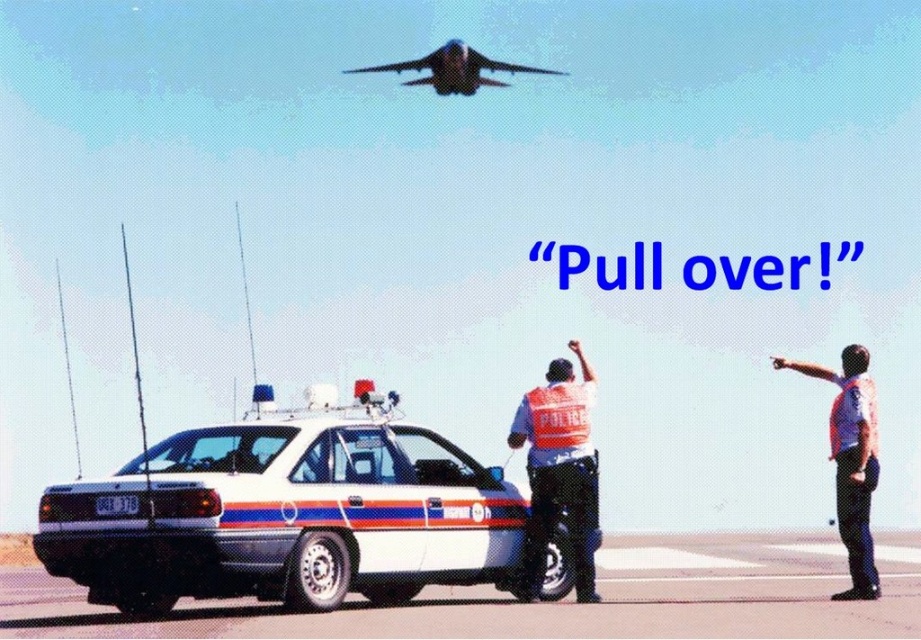
Consider the image. You are a photographer trying to capture a wide shot of the white glossy police car at center and the light blue uniform at center. Given that your camera can only focus on objects wider than 1 meter, will both objects be in focus?

The white glossy police car at center has a width less than the light blue uniform at center. Since the camera focuses on objects wider than 1 meter, only the light blue uniform at center will be in focus if it meets the width requirement, but the exact width of each object isn

You are a drone operator who needs to deliver a package to the reflective orange vest at center. The coordinates of the vest are given as point (558, 470). Is this point on the vest?

Yes, the point (558, 470) is on the reflective orange vest at center, so the package can be delivered there.